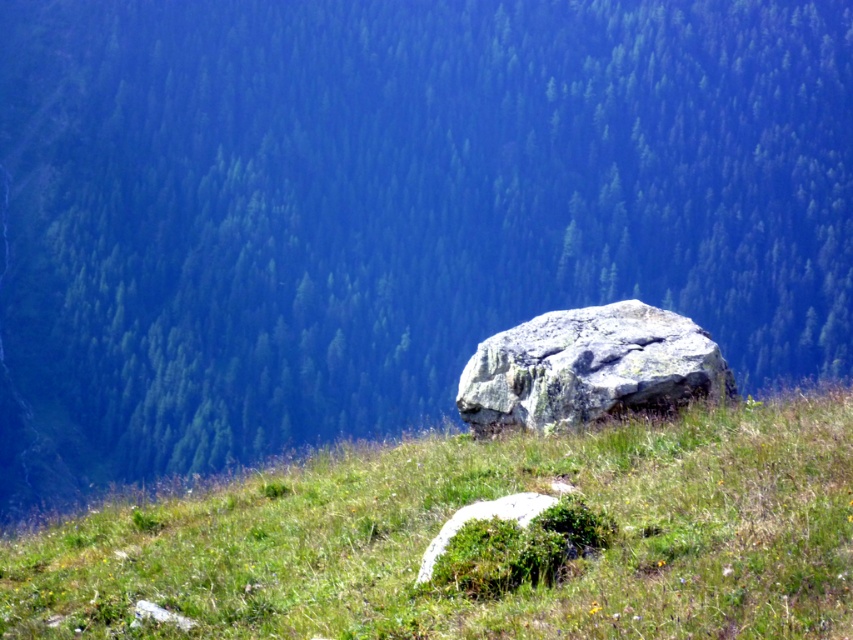
Between point (619, 534) and point (679, 378), which one is positioned in front?

Positioned in front is point (619, 534).

Is point (369, 625) closer to viewer compared to point (630, 397)?

That is True.

Is point (482, 461) closer to camera compared to point (666, 317)?

Yes.

Identify the location of green grassy at center. (457, 508).

Measure the distance from green grassy at center to green mossy rock at center.

2.85 meters

Does green grassy at center appear on the right side of green mossy rock at center?

Correct, you'll find green grassy at center to the right of green mossy rock at center.

Who is more forward, (833, 508) or (426, 552)?

Point (833, 508) is more forward.

Find the location of a particular element. green grassy at center is located at coordinates (457, 508).

Is the position of gray rough rock at center less distant than that of green mossy rock at center?

No.

Who is lower down, gray rough rock at center or green mossy rock at center?

green mossy rock at center is below.

Does point (498, 339) lie behind point (509, 497)?

Yes, point (498, 339) is behind point (509, 497).

Locate an element on the screen. This screenshot has height=640, width=853. gray rough rock at center is located at coordinates (589, 368).